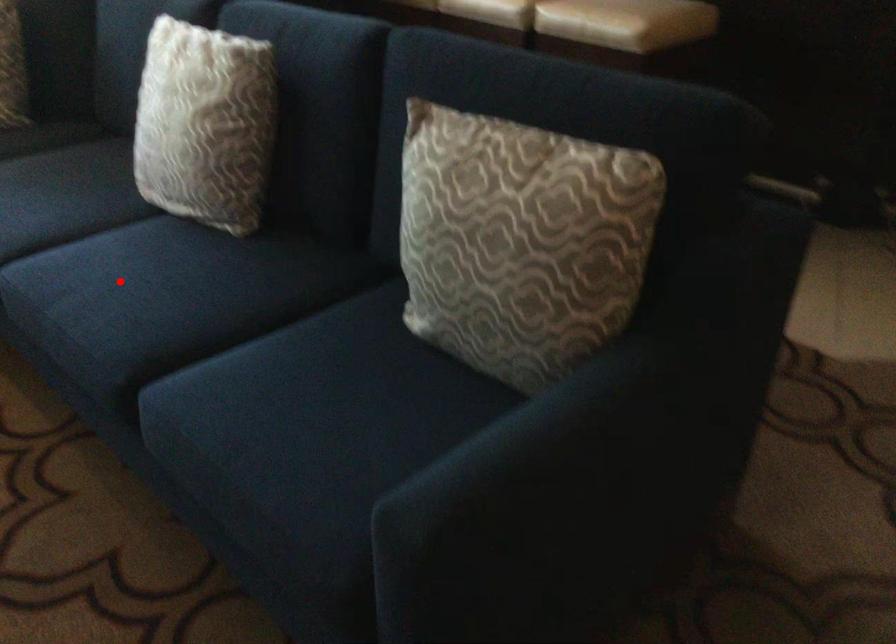
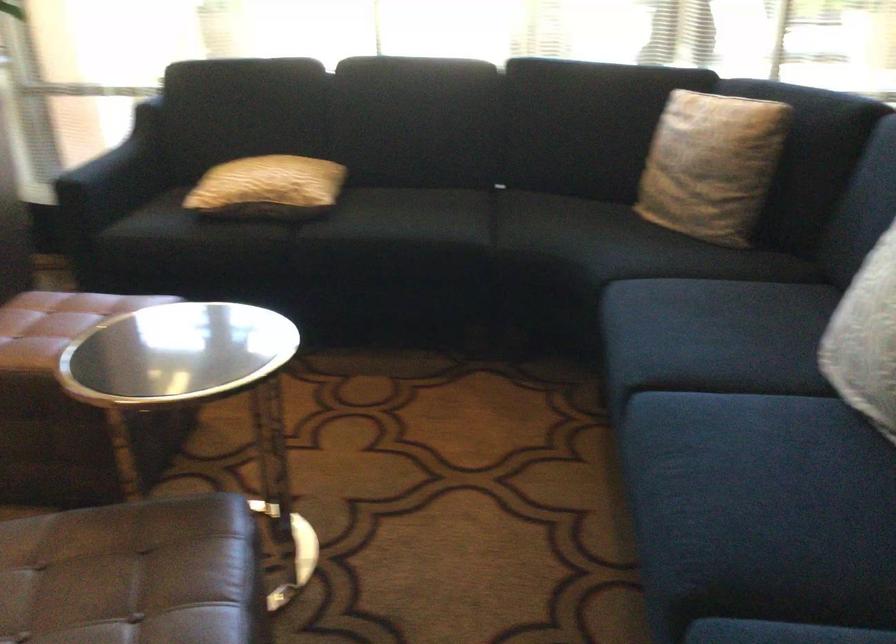
Question: I am providing you with two images of the same scene from different viewpoints. In image1, a red point is highlighted. Considering the same 3D point in image2, which of the following is correct?

Choices:
 (A) It is closer
 (B) It is farther

Answer: (A)